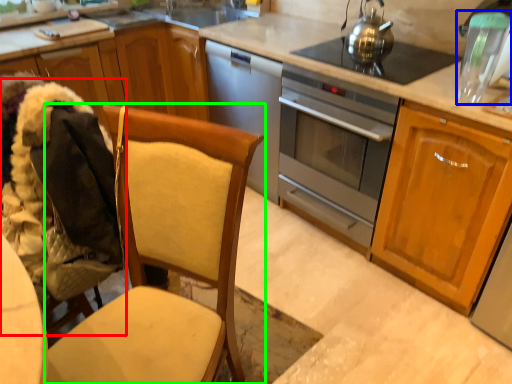
Question: Which is farther away from folding chair (highlighted by a red box)? appliance (highlighted by a blue box) or chair (highlighted by a green box)?

Choices:
 (A) appliance
 (B) chair

Answer: (A)